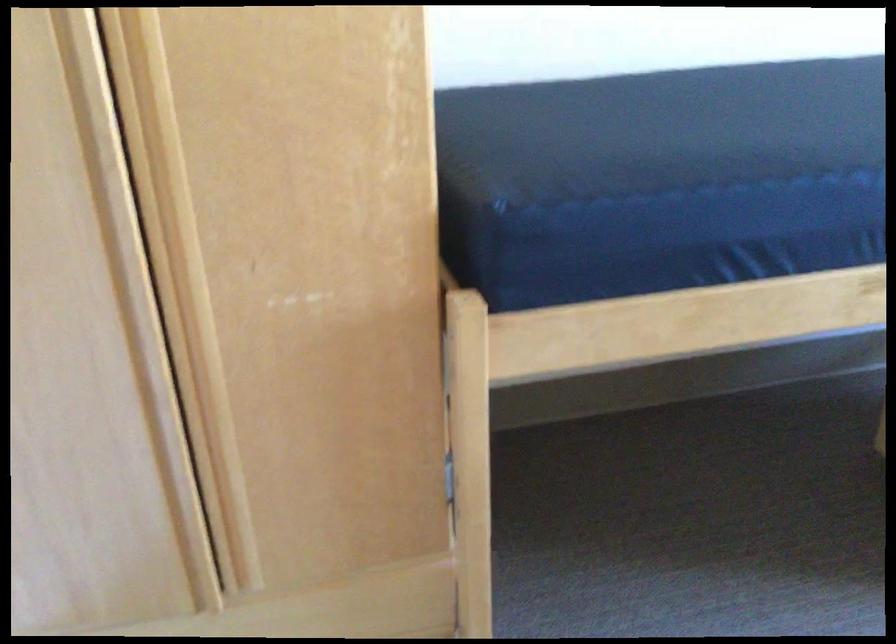
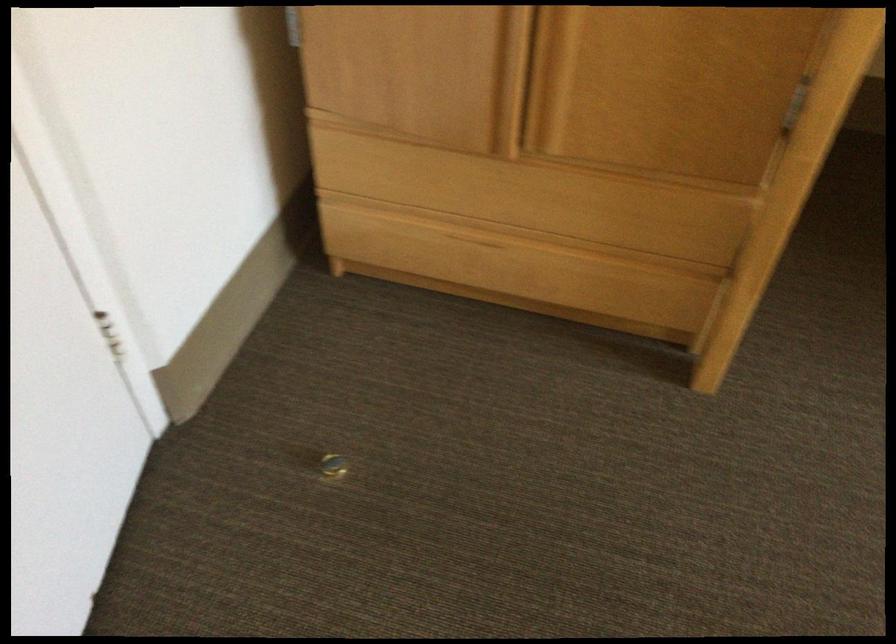
Find the pixel in the second image that matches point 211,532 in the first image.

(533, 79)